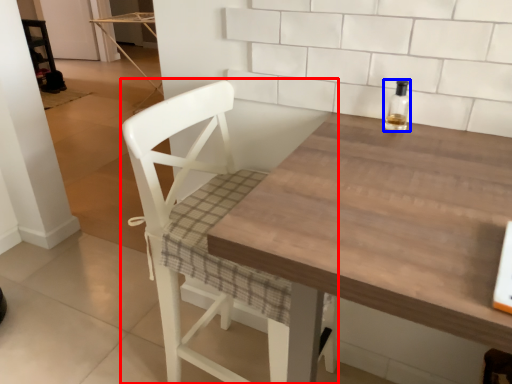
Question: Among these objects, which one is farthest to the camera, chair (highlighted by a red box) or bottle (highlighted by a blue box)?

Choices:
 (A) chair
 (B) bottle

Answer: (B)